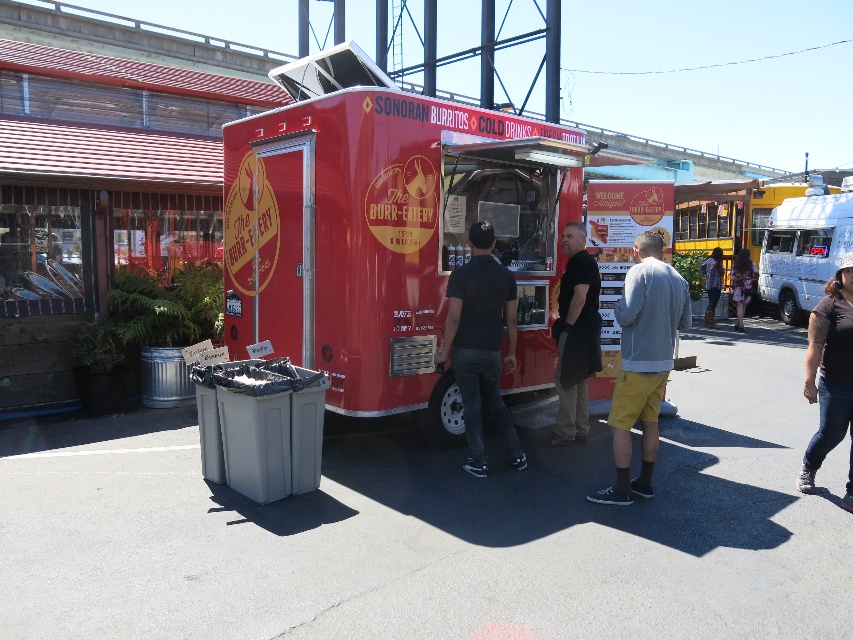
You are a food truck vendor at the shiny red food truck at center and you need to reach the floral shirt at center to hand them their order. Can you throw the burrito to them without leaving your station?

The distance between the shiny red food truck at center and the floral shirt at center is 11.67 meters, so you cannot throw the burrito to them without leaving your station as that distance is too far for a safe throw.

You are a customer at the food truck scene. You see a point marked at coordinates (375,234). What does this point represent?

The point at coordinates (375,234) indicates the location of the shiny red food truck at center.

Consider the image. You are standing at the red food truck labeled The Burr Eatery and want to walk towards the point at coordinates point (500, 422). Which direction should you move relative to the point at coordinates point (741, 308)?

To reach the point at coordinates point (500, 422), you should move towards it, which is in front of the point at coordinates point (741, 308).